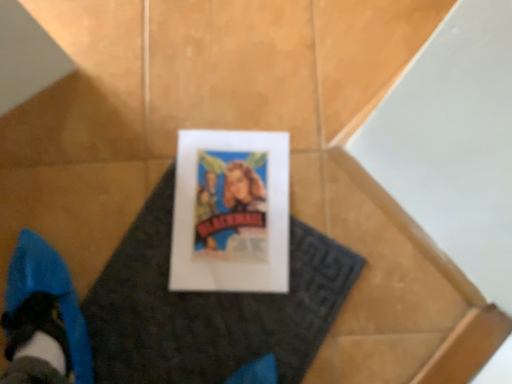
Question: Considering the positions of white paper at center and white paper at center in the image, is white paper at center bigger or smaller than white paper at center?

Choices:
 (A) small
 (B) big

Answer: (A)

Question: Considering the positions of white paper at center and white paper at center in the image, is white paper at center wider or thinner than white paper at center?

Choices:
 (A) thin
 (B) wide

Answer: (A)

Question: Is point (179, 152) positioned closer to the camera than point (330, 284)?

Choices:
 (A) farther
 (B) closer

Answer: (A)

Question: From the image's perspective, is white paper at center positioned above or below white paper at center?

Choices:
 (A) above
 (B) below

Answer: (B)

Question: From a real-world perspective, relative to white paper at center, is white paper at center vertically above or below?

Choices:
 (A) below
 (B) above

Answer: (A)

Question: Considering the positions of white paper at center and white paper at center in the image, is white paper at center bigger or smaller than white paper at center?

Choices:
 (A) small
 (B) big

Answer: (B)

Question: Does point (199, 309) appear closer or farther from the camera than point (238, 145)?

Choices:
 (A) closer
 (B) farther

Answer: (A)